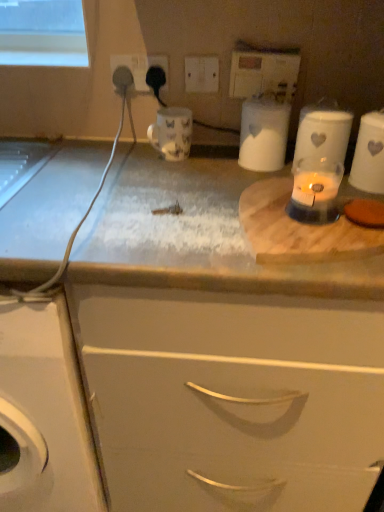
The height and width of the screenshot is (512, 384). What are the coordinates of `vacant region to the left of white matte container at upper center, which is the second appliance from left to right` in the screenshot? It's located at (205, 168).